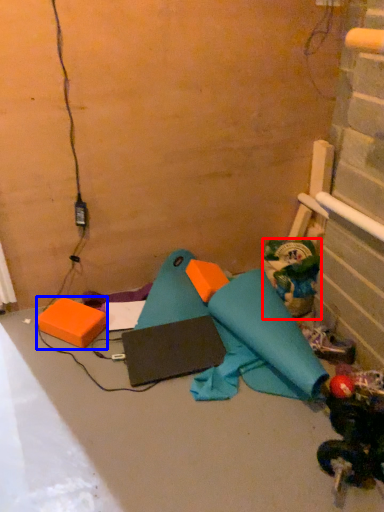
Question: Which point is further to the camera, toy (highlighted by a red box) or box (highlighted by a blue box)?

Choices:
 (A) toy
 (B) box

Answer: (A)